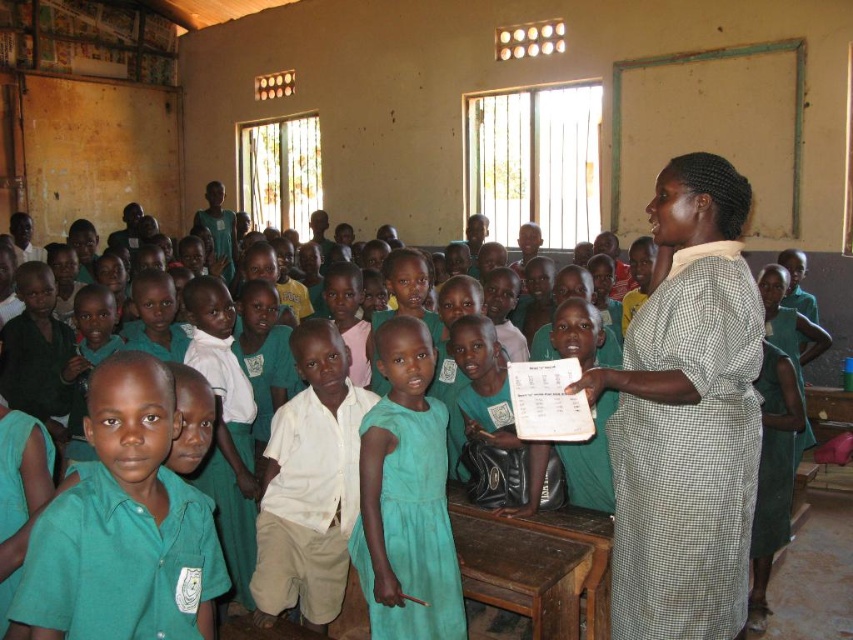
In the classroom scene, there are two teachers wearing different dresses. One is wearing a checkered fabric dress at right and the other a teal fabric dress at center. From the perspective of an observer standing at the entrance, which teacher is closer to the front of the classroom?

The checkered fabric dress at right is in front of the teal fabric dress at center, so the teacher wearing the checkered fabric dress at right is closer to the front of the classroom.

You are a photographer standing in the classroom. You need to take a closeup shot of the checkered fabric dress at right. The camera you have can focus on objects within 5 feet. Can you take the photo without moving closer?

The checkered fabric dress at right is 7.77 feet away from the camera, which is beyond the 5 feet focusing range. Therefore, you cannot take the closeup shot without moving closer.

You are a photographer taking a picture of the classroom. You notice two points in the scene labeled as point (744, 202) and point (405, 372). Which of these two points is nearer to the camera?

Point (744, 202) is closer to the camera than point (405, 372).